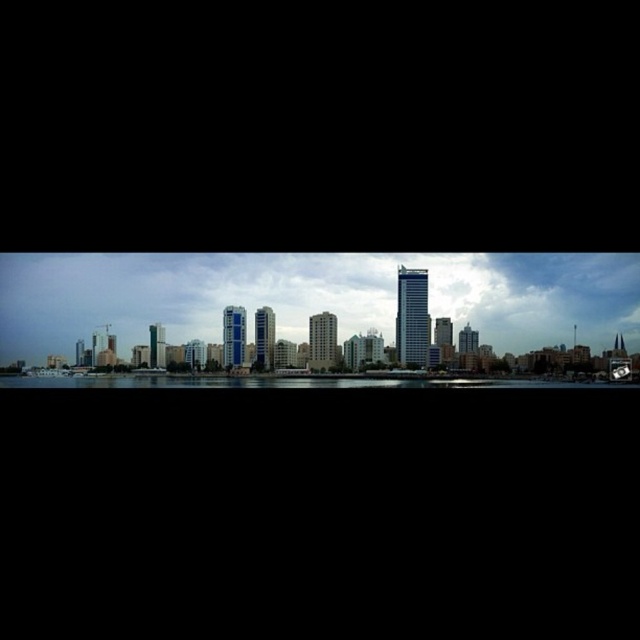
From the picture: Measure the distance from cloudy sky at center to transparent glass water at center.

cloudy sky at center is 19.85 meters away from transparent glass water at center.

Who is higher up, cloudy sky at center or transparent glass water at center?

Positioned higher is cloudy sky at center.

Is point (369, 262) positioned after point (529, 384)?

Yes, point (369, 262) is behind point (529, 384).

At what (x,y) coordinates should I click in order to perform the action: click on cloudy sky at center. Please return your answer as a coordinate pair (x, y). The width and height of the screenshot is (640, 640). Looking at the image, I should click on (310, 296).